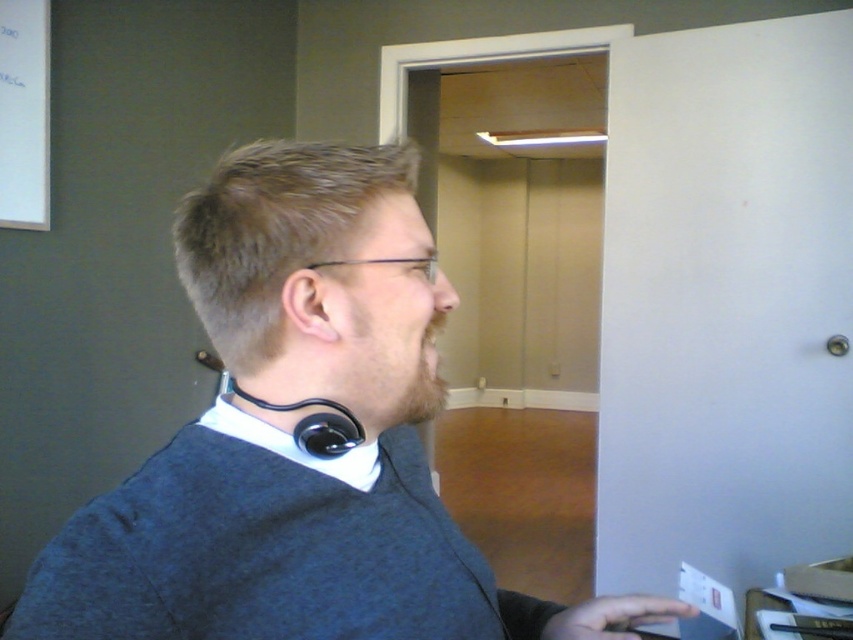
Which of these two, dark gray sweater at center or skinny black ear at center, stands taller?

dark gray sweater at center

Is point (350, 621) more distant than point (335, 292)?

That is False.

Image resolution: width=853 pixels, height=640 pixels. What do you see at coordinates (299, 442) in the screenshot?
I see `dark gray sweater at center` at bounding box center [299, 442].

In order to click on dark gray sweater at center in this screenshot , I will do `click(299, 442)`.